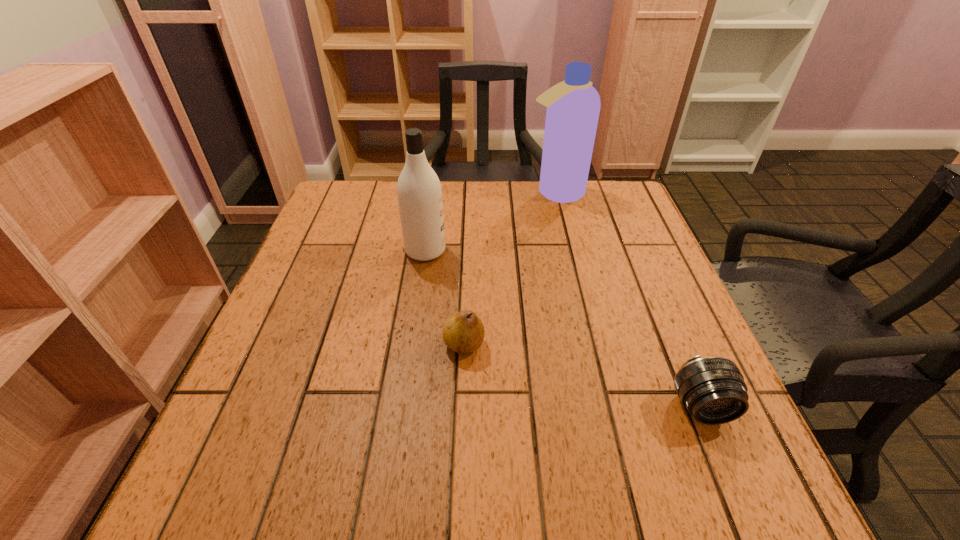
The image size is (960, 540). What are the coordinates of `vacant space at the far left corner` in the screenshot? It's located at (348, 217).

At what (x,y) coordinates should I click in order to perform the action: click on blank space at the near left corner. Please return your answer as a coordinate pair (x, y). Looking at the image, I should click on (302, 472).

Find the location of `vacant position at the far right corner of the desktop`. vacant position at the far right corner of the desktop is located at coordinates (603, 183).

You are a GUI agent. You are given a task and a screenshot of the screen. Output one action in this format:
    pyautogui.click(x=<x>, y=<y>)
    Task: Click on the free space between the pear and the second farthest object
    Image resolution: width=960 pixels, height=540 pixels.
    Given the screenshot: What is the action you would take?
    pyautogui.click(x=444, y=298)

The height and width of the screenshot is (540, 960). What are the coordinates of `free area in between the nearer shampoo and the telephoto lens` in the screenshot? It's located at (564, 329).

At what (x,y) coordinates should I click in order to perform the action: click on free spot between the rightmost object and the nearer shampoo. Please return your answer as a coordinate pair (x, y). Looking at the image, I should click on (564, 329).

Locate an element on the screen. This screenshot has width=960, height=540. free point between the nearest object and the right shampoo is located at coordinates (629, 300).

The height and width of the screenshot is (540, 960). What are the coordinates of `vacant space that's between the right shampoo and the left shampoo` in the screenshot? It's located at (491, 222).

Image resolution: width=960 pixels, height=540 pixels. Find the location of `free space that is in between the nearest object and the left shampoo`. free space that is in between the nearest object and the left shampoo is located at coordinates (564, 329).

Find the location of a particular element. Image resolution: width=960 pixels, height=540 pixels. free space between the nearest object and the pear is located at coordinates (583, 376).